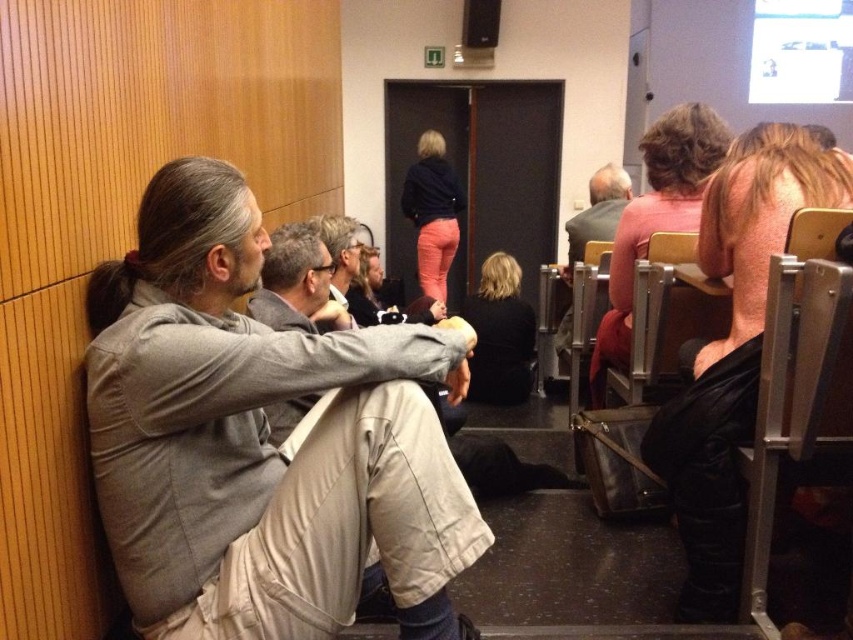
You are organizing a photo shoot and need to arrange the subjects so that the matte pink sweater at center right and the dark green sweater at center are visible in the frame. Based on their heights, which one should be positioned closer to the camera to ensure both are fully visible?

The matte pink sweater at center right is much taller than the dark green sweater at center, so positioning the dark green sweater at center closer to the camera will help ensure both are fully visible.